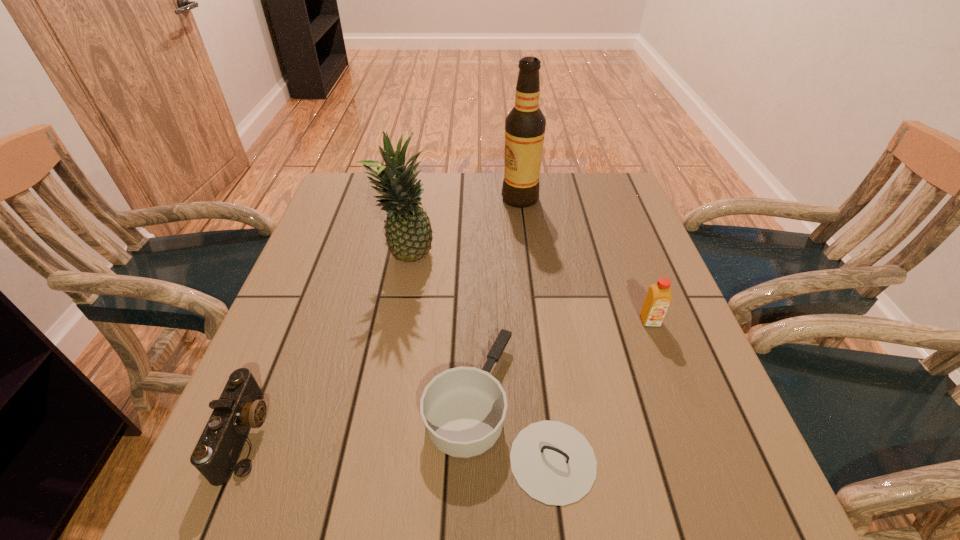
Image resolution: width=960 pixels, height=540 pixels. Identify the location of free space located 0.070m on the label of the alcohol. (478, 199).

You are a GUI agent. You are given a task and a screenshot of the screen. Output one action in this format:
    pyautogui.click(x=<x>, y=<y>)
    Task: Click on the vacant space located 0.250m on the label of the alcohol
    The width and height of the screenshot is (960, 540).
    Given the screenshot: What is the action you would take?
    pyautogui.click(x=418, y=199)

You are a GUI agent. You are given a task and a screenshot of the screen. Output one action in this format:
    pyautogui.click(x=<x>, y=<y>)
    Task: Click on the blank space located 0.080m on the right of the second tallest object
    This screenshot has width=960, height=540.
    Given the screenshot: What is the action you would take?
    pyautogui.click(x=466, y=256)

At what (x,y) coordinates should I click in order to perform the action: click on free space located 0.330m on the front and back of the third farthest object. Please return your answer as a coordinate pair (x, y). This screenshot has height=540, width=960. Looking at the image, I should click on (711, 486).

Identify the location of free space located 0.150m on the front-facing side of the camera. (352, 435).

In order to click on blank space located on the back of the shortest object in this screenshot , I will do `click(497, 226)`.

You are a GUI agent. You are given a task and a screenshot of the screen. Output one action in this format:
    pyautogui.click(x=<x>, y=<y>)
    Task: Click on the object that is positioned at the far edge
    The image size is (960, 540).
    Given the screenshot: What is the action you would take?
    pyautogui.click(x=525, y=125)

Locate an element on the screen. The height and width of the screenshot is (540, 960). camera located in the near edge section of the desktop is located at coordinates (240, 407).

Locate an element on the screen. The width and height of the screenshot is (960, 540). saucepan that is at the near edge is located at coordinates (463, 408).

In order to click on object that is at the left edge in this screenshot , I will do (240, 407).